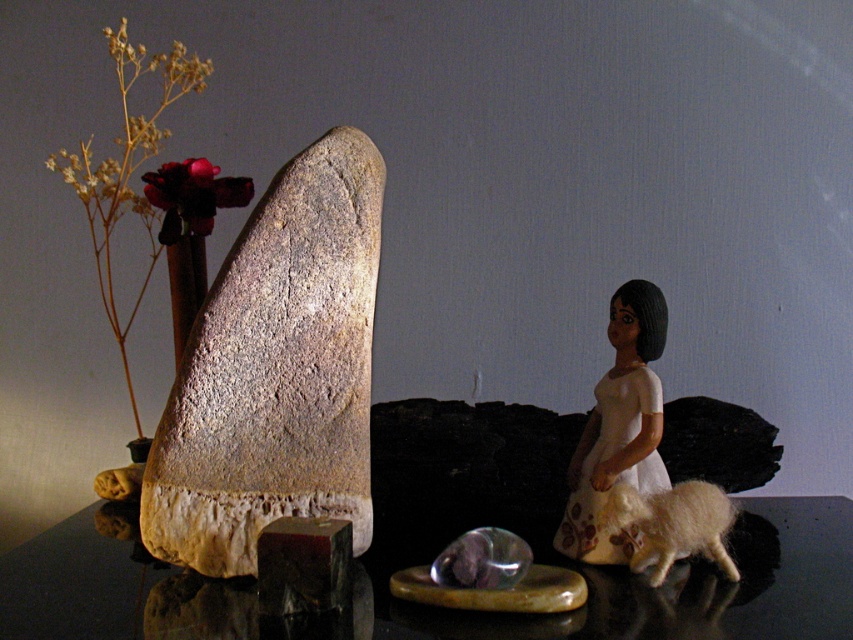
Question: Which of the following is the closest to the observer?

Choices:
 (A) rusty stone rock at left
 (B) white woolen lamb at lower right
 (C) black glossy table at center

Answer: (C)

Question: Observing the image, what is the correct spatial positioning of white woolen lamb at lower right in reference to matte brown vase at center?

Choices:
 (A) above
 (B) below

Answer: (B)

Question: Which of the following is the closest to the observer?

Choices:
 (A) matte brown vase at center
 (B) black glossy table at center
 (C) white woolen lamb at lower right

Answer: (B)

Question: Which of the following is the closest to the observer?

Choices:
 (A) (172, 244)
 (B) (198, 196)
 (C) (247, 317)

Answer: (C)

Question: Does velvety crimson bloom at upper left have a smaller size compared to matte brown vase at center?

Choices:
 (A) yes
 (B) no

Answer: (B)

Question: Does rusty stone rock at left appear over white matte dress at center right?

Choices:
 (A) no
 (B) yes

Answer: (B)